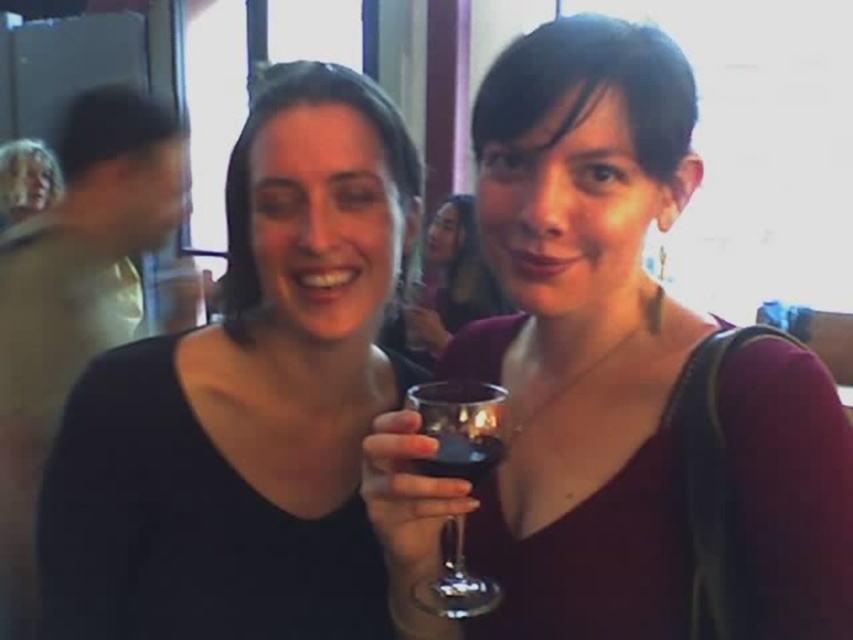
What do you see at coordinates (26, 179) in the screenshot?
I see `blonde hair at upper left` at bounding box center [26, 179].

Is blonde hair at upper left to the left of transparent glass at center from the viewer's perspective?

Indeed, blonde hair at upper left is positioned on the left side of transparent glass at center.

Measure the distance between blonde hair at upper left and camera.

A distance of 3.23 meters exists between blonde hair at upper left and camera.

You are a GUI agent. You are given a task and a screenshot of the screen. Output one action in this format:
    pyautogui.click(x=<x>, y=<y>)
    Task: Click on the blonde hair at upper left
    
    Given the screenshot: What is the action you would take?
    pyautogui.click(x=26, y=179)

Who is positioned more to the right, matte glass wine at center or blonde hair at upper left?

Positioned to the right is matte glass wine at center.

Who is lower down, matte glass wine at center or blonde hair at upper left?

Positioned lower is matte glass wine at center.

What do you see at coordinates (612, 380) in the screenshot?
I see `matte glass wine at center` at bounding box center [612, 380].

At what (x,y) coordinates should I click in order to perform the action: click on matte glass wine at center. Please return your answer as a coordinate pair (x, y). Looking at the image, I should click on (612, 380).

Between black matte wine glass at center and blonde hair at upper left, which one appears on the left side from the viewer's perspective?

Positioned to the left is blonde hair at upper left.

Between black matte wine glass at center and blonde hair at upper left, which one has less height?

Standing shorter between the two is blonde hair at upper left.

Is point (339, 305) behind point (16, 195)?

No.

The height and width of the screenshot is (640, 853). In order to click on black matte wine glass at center in this screenshot , I will do `click(248, 401)`.